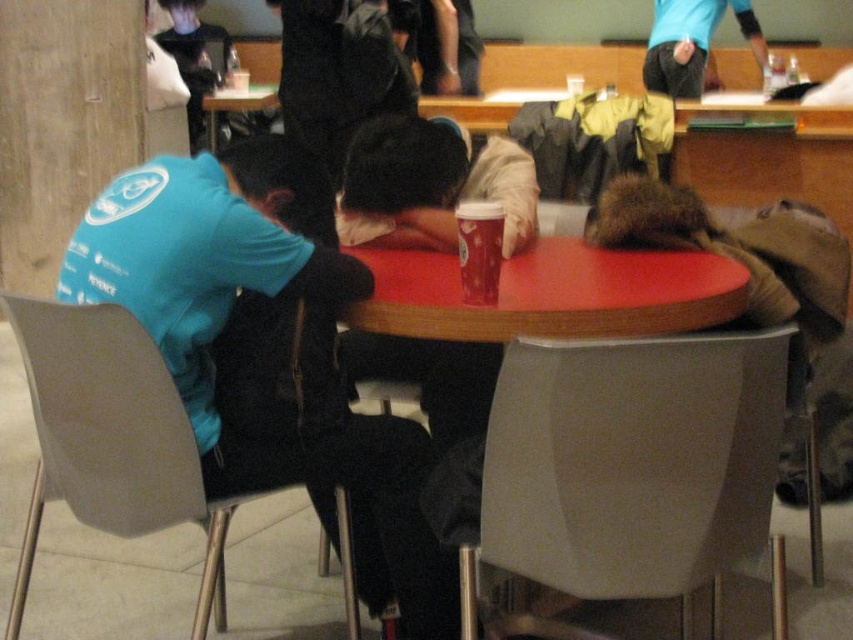
Question: Which point is closer to the camera?

Choices:
 (A) (166, 476)
 (B) (643, 301)
 (C) (140, 192)

Answer: (B)

Question: Which of the following is the closest to the observer?

Choices:
 (A) (373, 321)
 (B) (496, 300)
 (C) (134, 177)

Answer: (B)

Question: Can you confirm if blue fleece jacket at left is positioned above matte plastic cup at center?

Choices:
 (A) no
 (B) yes

Answer: (A)

Question: Does matte gray chair at lower center appear under matte plastic chair at lower left?

Choices:
 (A) yes
 (B) no

Answer: (B)

Question: Which object appears farthest from the camera in this image?

Choices:
 (A) matte plastic cup at center
 (B) matte plastic chair at lower left

Answer: (A)

Question: Is the position of matte plastic chair at lower left less distant than that of matte plastic cup at center?

Choices:
 (A) yes
 (B) no

Answer: (A)